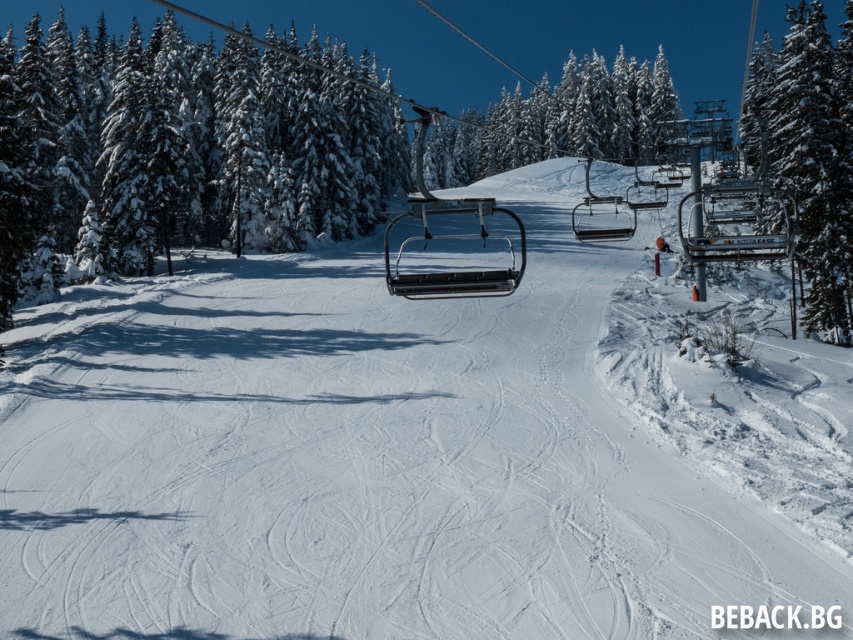
Does point (473, 156) come closer to viewer compared to point (457, 276)?

That is False.

Is point (648, 72) farther from viewer compared to point (460, 236)?

Yes.

Find the location of a particular element. The height and width of the screenshot is (640, 853). green snow-covered tree at center is located at coordinates (558, 122).

Is metallic black ski lift at center wider than metallic silver chairlift at center?

Incorrect, metallic black ski lift at center's width does not surpass metallic silver chairlift at center's.

Between point (502, 275) and point (612, 198), which one is positioned in front?

Point (502, 275)

Locate an element on the screen. The image size is (853, 640). metallic black ski lift at center is located at coordinates (453, 272).

Who is taller, green snow-covered tree at right or metallic silver chairlift at center?

With more height is green snow-covered tree at right.

Where is `green snow-covered tree at right`? green snow-covered tree at right is located at coordinates (810, 154).

The width and height of the screenshot is (853, 640). I want to click on green snow-covered tree at right, so click(810, 154).